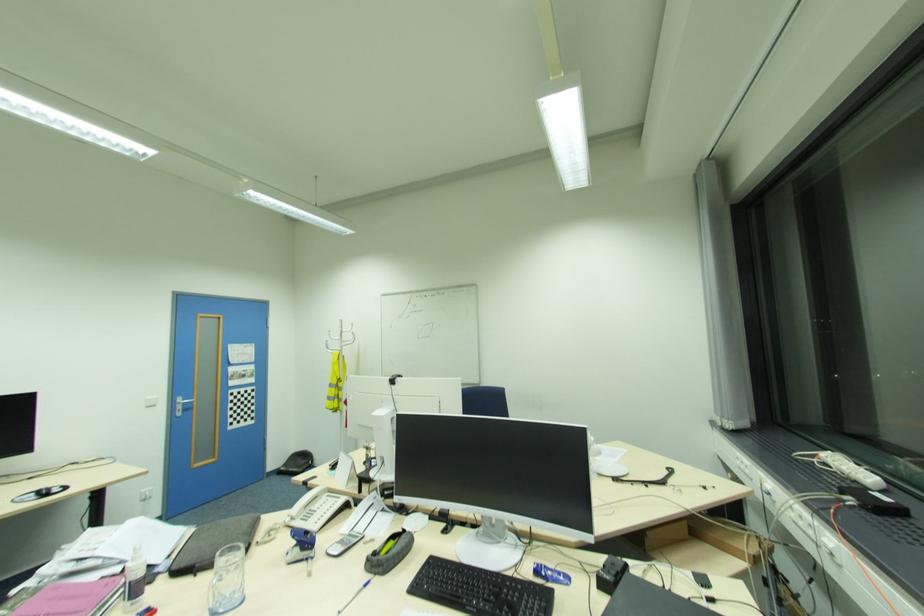
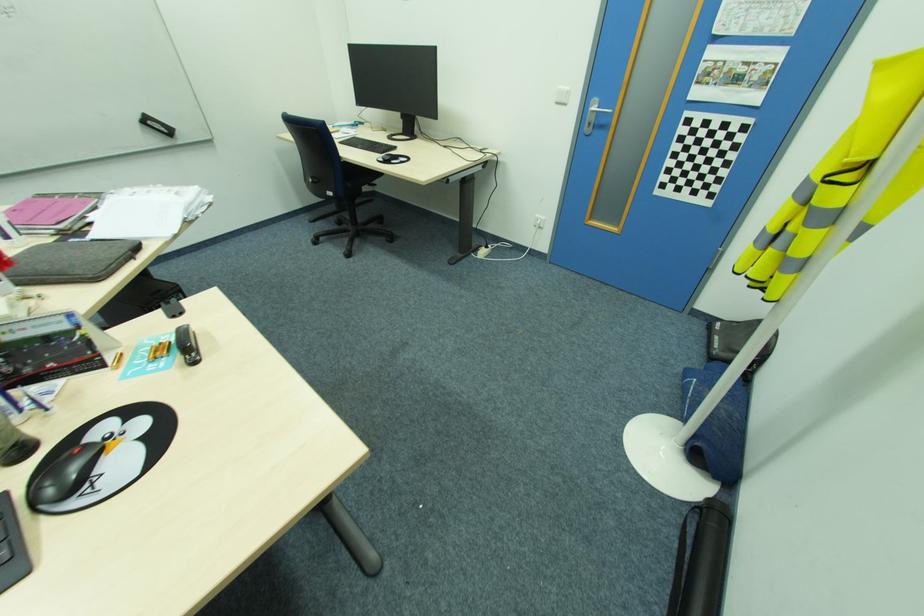
Locate, in the second image, the point that corresponds to point 186,400 in the first image.

(600, 108)